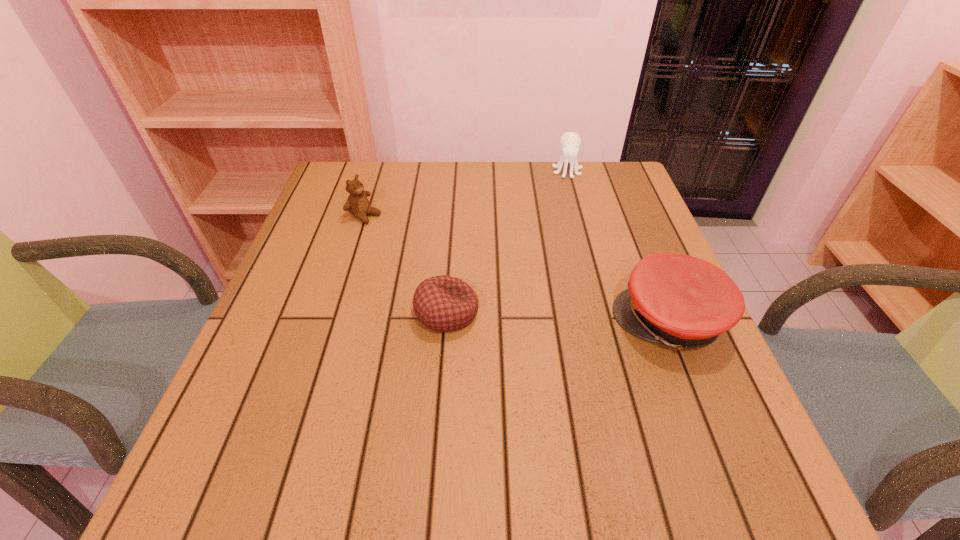
The image size is (960, 540). Identify the location of the shortest object. (442, 303).

Identify the location of beanbag. The height and width of the screenshot is (540, 960). (442, 303).

At what (x,y) coordinates should I click in order to perform the action: click on cap. Please return your answer as a coordinate pair (x, y). The image size is (960, 540). Looking at the image, I should click on (681, 301).

Where is `the leftmost object`? the leftmost object is located at coordinates (357, 204).

Locate an element on the screen. The width and height of the screenshot is (960, 540). the second farthest object is located at coordinates pyautogui.click(x=357, y=204).

Identify the location of the farthest object. (570, 142).

At what (x,y) coordinates should I click in order to perform the action: click on vacant space located on the back of the beanbag. Please return your answer as a coordinate pair (x, y). The width and height of the screenshot is (960, 540). Looking at the image, I should click on (452, 236).

Where is `free space located 0.180m on the front of the cap with an emblem`? The image size is (960, 540). free space located 0.180m on the front of the cap with an emblem is located at coordinates (527, 321).

This screenshot has width=960, height=540. In order to click on blank space located on the front of the cap with an emblem in this screenshot , I will do `click(434, 321)`.

Locate an element on the screen. This screenshot has width=960, height=540. vacant space located on the front of the cap with an emblem is located at coordinates (468, 321).